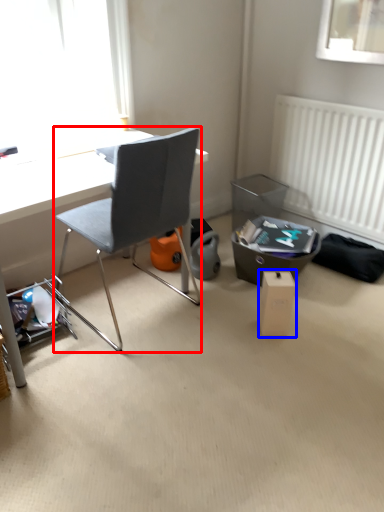
Question: Which object is further to the camera taking this photo, chair (highlighted by a red box) or cardboard box (highlighted by a blue box)?

Choices:
 (A) chair
 (B) cardboard box

Answer: (B)